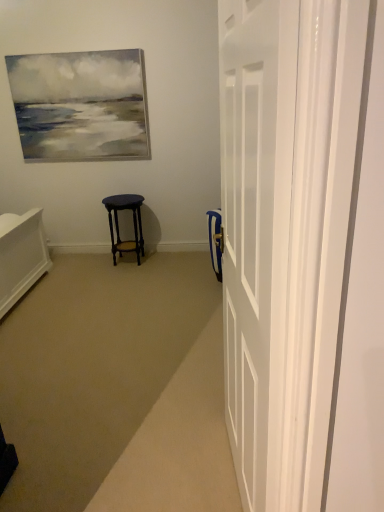
Question: Is matte dark wood stool at center in front of or behind white glossy door at right in the image?

Choices:
 (A) behind
 (B) front

Answer: (A)

Question: Looking at their shapes, would you say matte dark wood stool at center is wider or thinner than white glossy door at right?

Choices:
 (A) thin
 (B) wide

Answer: (B)

Question: Based on their sizes in the image, would you say matte dark wood stool at center is bigger or smaller than white glossy door at right?

Choices:
 (A) small
 (B) big

Answer: (A)

Question: Is point (236, 295) positioned closer to the camera than point (137, 237)?

Choices:
 (A) closer
 (B) farther

Answer: (A)

Question: Is white glossy door at right wider or thinner than matte dark wood stool at center?

Choices:
 (A) wide
 (B) thin

Answer: (B)

Question: In terms of size, does white glossy door at right appear bigger or smaller than matte dark wood stool at center?

Choices:
 (A) big
 (B) small

Answer: (A)

Question: Would you say white glossy door at right is to the left or to the right of matte dark wood stool at center in the picture?

Choices:
 (A) right
 (B) left

Answer: (A)